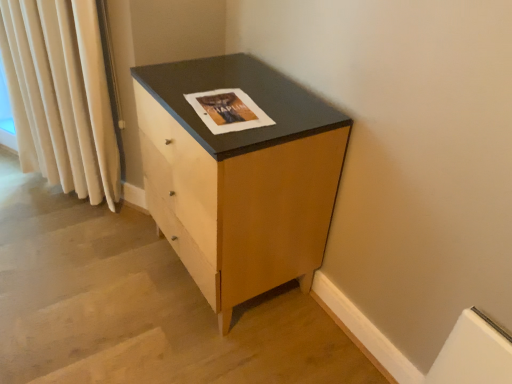
This screenshot has width=512, height=384. I want to click on free space above matte wood chest of drawers at center (from a real-world perspective), so click(x=233, y=96).